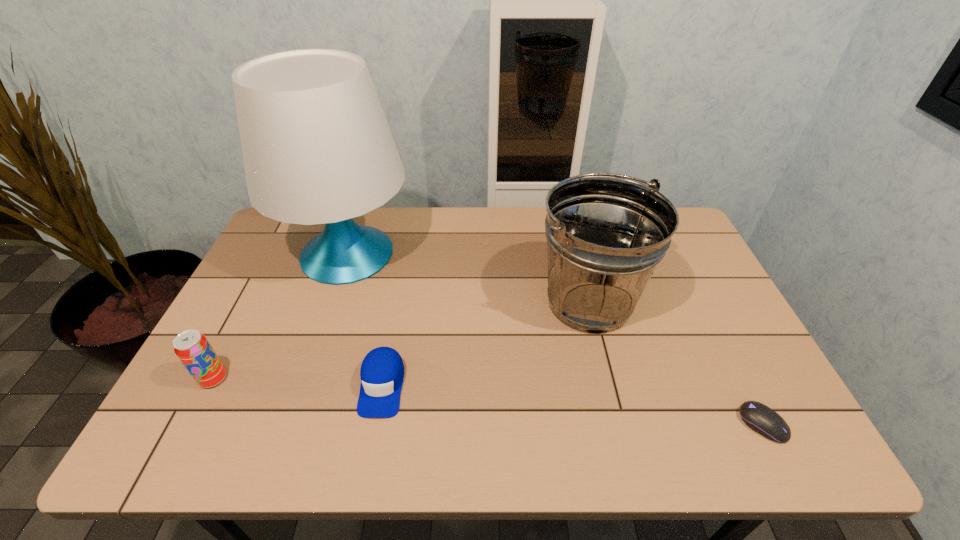
This screenshot has width=960, height=540. In order to click on table lamp in this screenshot , I will do `click(317, 149)`.

The image size is (960, 540). In order to click on the second object from right to left in this screenshot , I will do `click(605, 235)`.

You are a GUI agent. You are given a task and a screenshot of the screen. Output one action in this format:
    pyautogui.click(x=<x>, y=<y>)
    Task: Click on the bucket
    
    Given the screenshot: What is the action you would take?
    pyautogui.click(x=605, y=235)

Find the location of `the third tallest object`. the third tallest object is located at coordinates click(x=193, y=349).

Locate an element on the screen. The height and width of the screenshot is (540, 960). baseball cap is located at coordinates (382, 371).

Where is `the rightmost object`? The image size is (960, 540). the rightmost object is located at coordinates (760, 418).

Locate an element on the screen. Image resolution: width=960 pixels, height=540 pixels. the shortest object is located at coordinates (760, 418).

What are the coordinates of `vacant region located on the front-facing side of the table lamp` in the screenshot? It's located at (439, 253).

This screenshot has width=960, height=540. In order to click on free region located 0.210m on the left of the fourth shortest object in this screenshot , I will do `click(462, 302)`.

At what (x,y) coordinates should I click in order to perform the action: click on free space located on the right of the soda can. Please return your answer as a coordinate pair (x, y). This screenshot has height=540, width=960. Looking at the image, I should click on (365, 379).